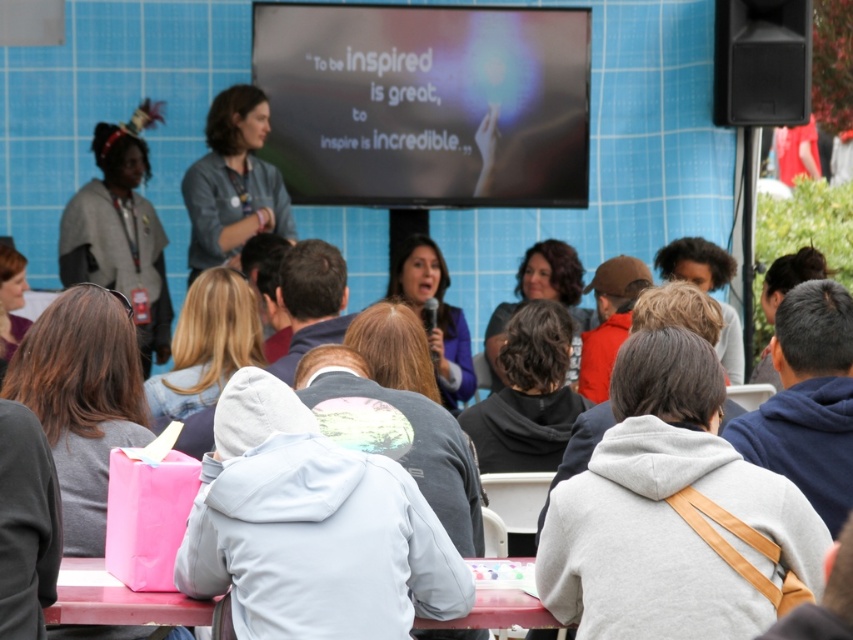
You are a photographer at the event and want to capture a photo of the gray hoodie at center without any obstructions. Since the pink plastic table at lower center is in the way, can you move it to the side to get a clear shot?

The pink plastic table at lower center is behind the gray hoodie at center, so moving it would not be necessary as it is already positioned behind and not obstructing the view of the gray hoodie at center.

You are a photographer standing at the edge of the event area. You need to take a photo that includes both the gray hoodie at center and the pink plastic table at lower center. Given that your camera has a maximum focus range of 7 meters, will you be able to capture both subjects in focus without moving closer?

The gray hoodie at center and the pink plastic table at lower center are 7.68 meters apart from each other. Since the camera can only focus up to 7 meters, the distance between them exceeds the focus range. Therefore, you cannot capture both in focus without moving closer.